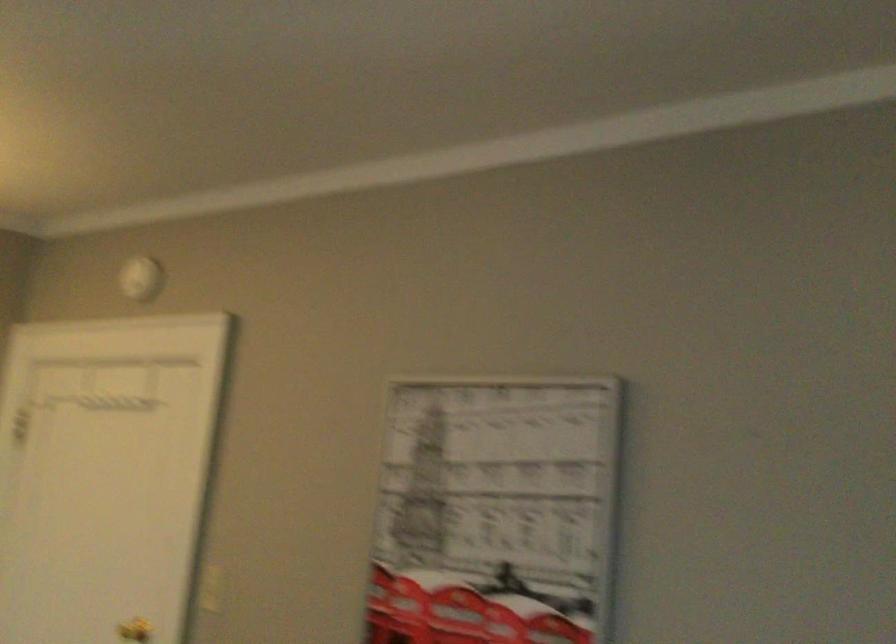
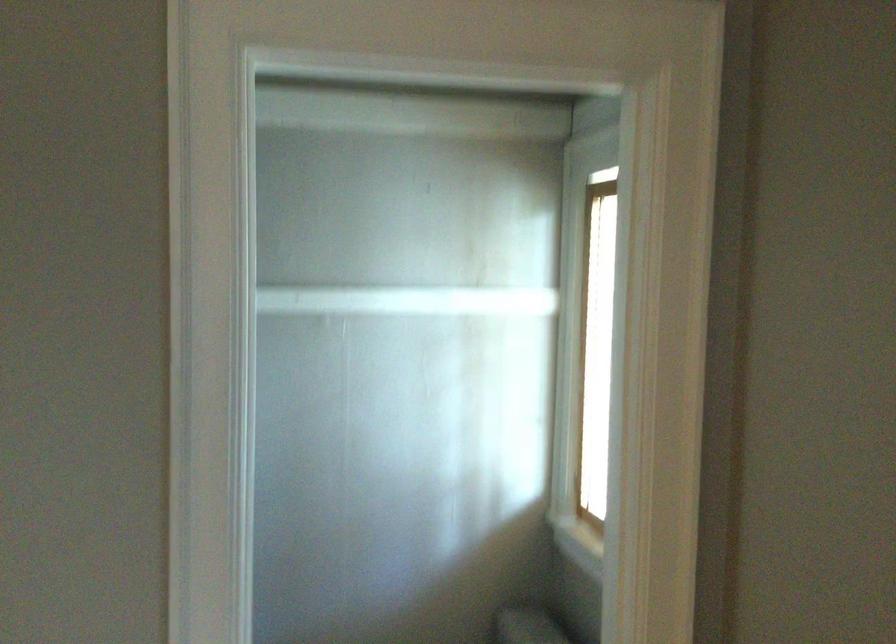
Question: The camera is either moving clockwise (left) or counter-clockwise (right) around the object. The first image is from the beginning of the video and the second image is from the end. Is the camera moving left or right when shooting the video?

Choices:
 (A) Left
 (B) Right

Answer: (A)